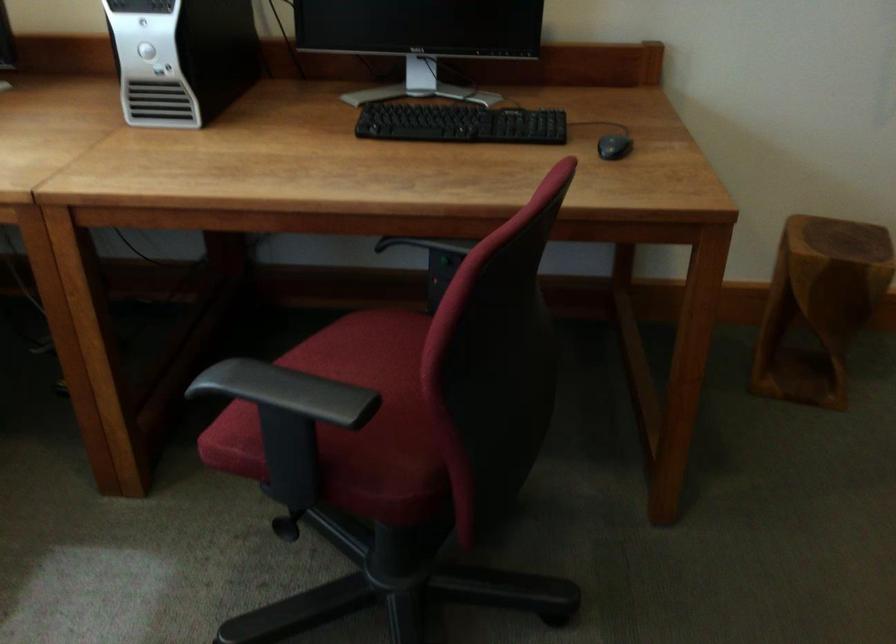
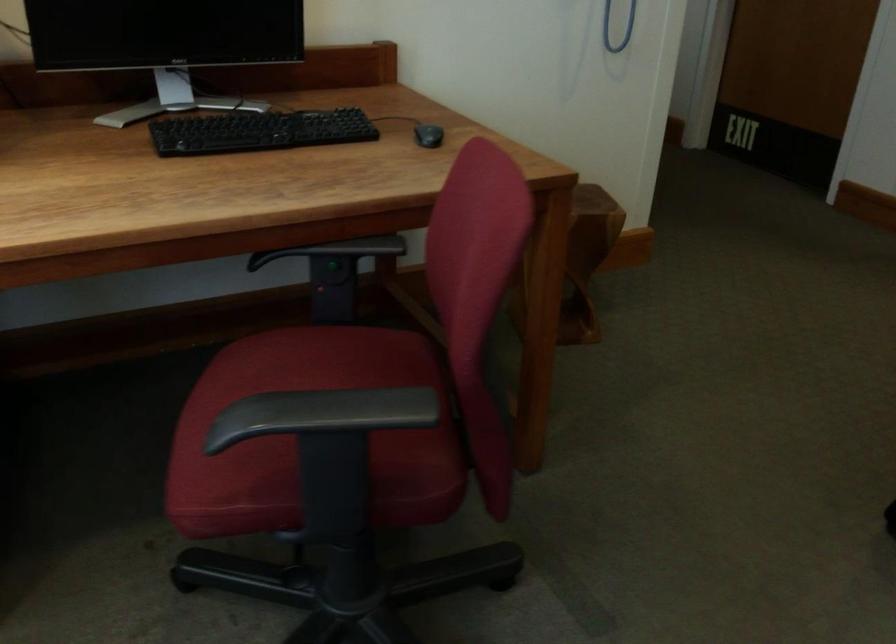
Where in the second image is the point corresponding to [251,402] from the first image?

(309, 433)